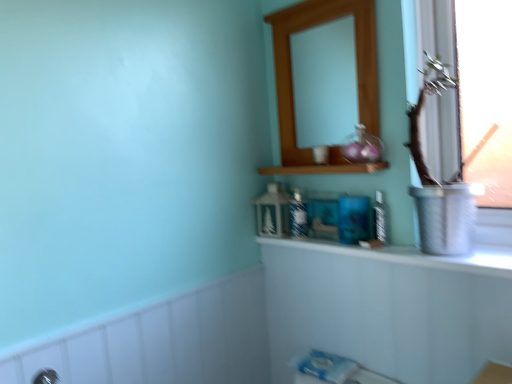
This screenshot has width=512, height=384. I want to click on free location in front of matte blue glass toiletry at center, which is the second toiletry from front to back, so click(x=321, y=243).